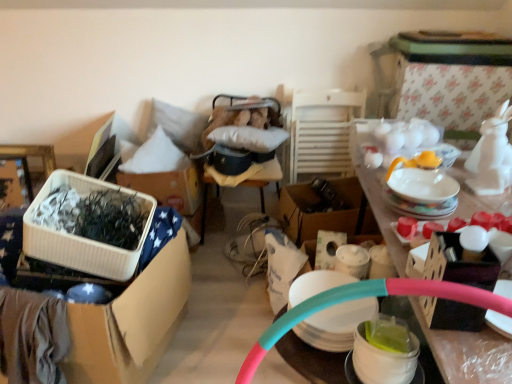
Question: Can you confirm if white glossy table at upper right is positioned to the right of white plastic container at left, which is counted as the 1th box, starting from the front?

Choices:
 (A) yes
 (B) no

Answer: (A)

Question: Is white glossy table at upper right thinner than white plastic container at left, the first box from the left?

Choices:
 (A) no
 (B) yes

Answer: (A)

Question: Is white glossy table at upper right facing away from white plastic container at left, the first box from the left?

Choices:
 (A) yes
 (B) no

Answer: (B)

Question: Are white glossy table at upper right and white plastic container at left, the first box from the left, located far from each other?

Choices:
 (A) no
 (B) yes

Answer: (A)

Question: Does white glossy table at upper right have a greater width compared to white plastic container at left, which is counted as the 1th box, starting from the front?

Choices:
 (A) no
 (B) yes

Answer: (B)

Question: In the image, is white wooden chair at center on the left side or the right side of white plastic container at left, which is counted as the 1th box, starting from the front?

Choices:
 (A) right
 (B) left

Answer: (A)

Question: From the image's perspective, is white wooden chair at center located above or below white plastic container at left, arranged as the 2th box when viewed from the back?

Choices:
 (A) below
 (B) above

Answer: (B)

Question: Considering the positions of point (336, 125) and point (126, 299), is point (336, 125) closer or farther from the camera than point (126, 299)?

Choices:
 (A) farther
 (B) closer

Answer: (A)

Question: Considering their positions, is white wooden chair at center located in front of or behind white plastic container at left, arranged as the 2th box when viewed from the back?

Choices:
 (A) front
 (B) behind

Answer: (B)

Question: Considering the positions of white glossy bowl at lower right and translucent plastic cups at center in the image, is white glossy bowl at lower right wider or thinner than translucent plastic cups at center?

Choices:
 (A) wide
 (B) thin

Answer: (B)

Question: Is white glossy bowl at lower right bigger or smaller than translucent plastic cups at center?

Choices:
 (A) small
 (B) big

Answer: (A)

Question: Is white glossy bowl at lower right in front of or behind translucent plastic cups at center in the image?

Choices:
 (A) front
 (B) behind

Answer: (A)

Question: From the image's perspective, relative to translucent plastic cups at center, is white glossy bowl at lower right above or below?

Choices:
 (A) above
 (B) below

Answer: (B)

Question: Based on their sizes in the image, would you say white glossy table at upper right is bigger or smaller than white soft pillow at upper left?

Choices:
 (A) small
 (B) big

Answer: (B)

Question: Does point (465, 206) appear closer or farther from the camera than point (141, 158)?

Choices:
 (A) closer
 (B) farther

Answer: (A)